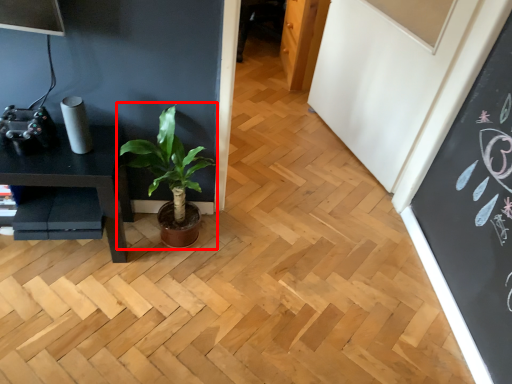
Question: From the image's perspective, what is the correct spatial positioning of houseplant (annotated by the red box) in reference to table?

Choices:
 (A) below
 (B) above

Answer: (B)